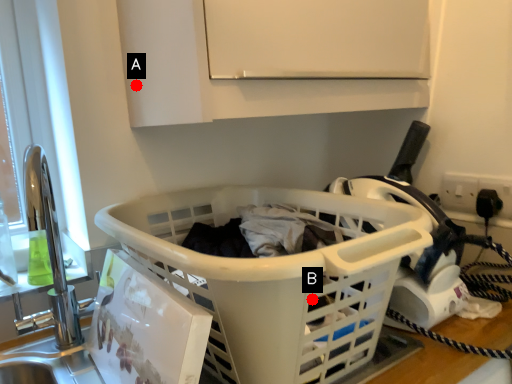
Question: Two points are circled on the image, labeled by A and B beside each circle. Among these points, which one is nearest to the camera?

Choices:
 (A) A is closer
 (B) B is closer

Answer: (B)